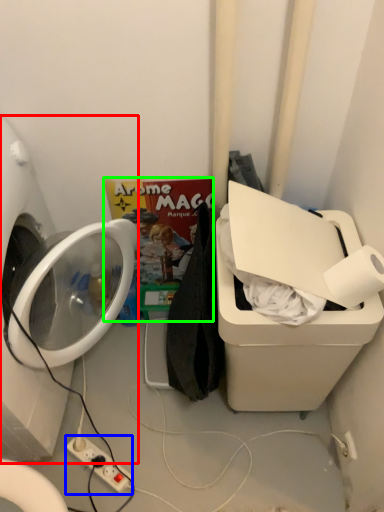
Question: Based on their relative distances, which object is farther from washing machine (highlighted by a red box)? Choose from electric outlet (highlighted by a blue box) and comic book (highlighted by a green box).

Choices:
 (A) electric outlet
 (B) comic book

Answer: (A)